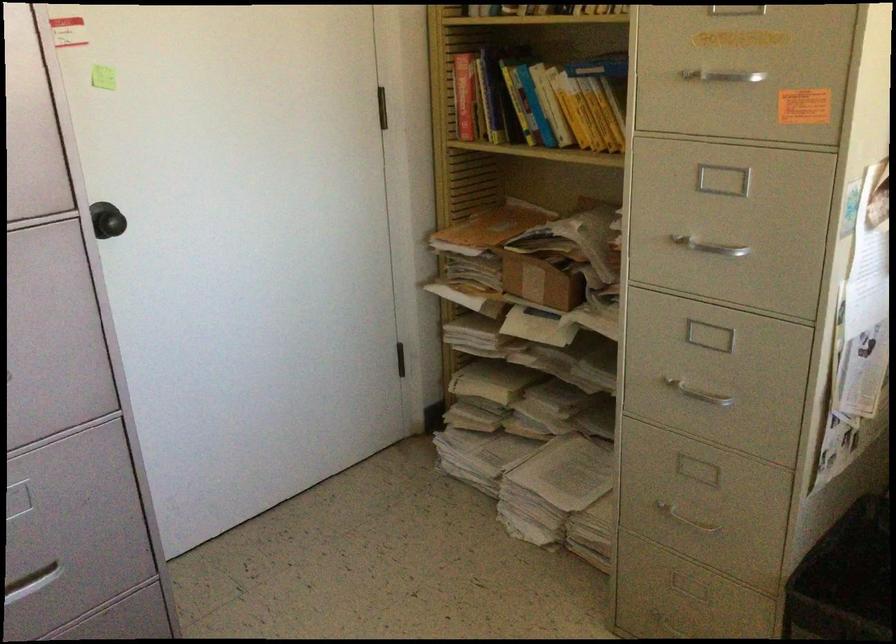
Find where to lift the small cardboard box. Please return your answer as a coordinate pair (x, y).

(539, 281)